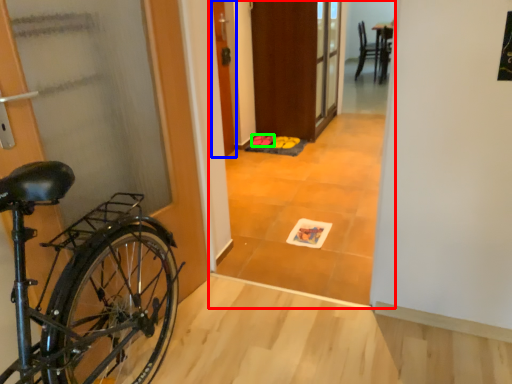
Question: Based on their relative distances, which object is nearer to corridor (highlighted by a red box)? Choose from door (highlighted by a blue box) and footwear (highlighted by a green box).

Choices:
 (A) door
 (B) footwear

Answer: (A)